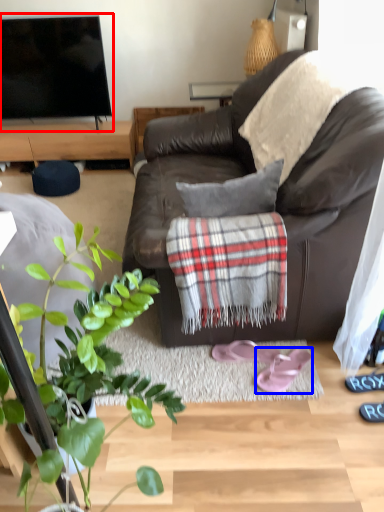
Question: Among these objects, which one is farthest to the camera, television (highlighted by a red box) or footwear (highlighted by a blue box)?

Choices:
 (A) television
 (B) footwear

Answer: (A)